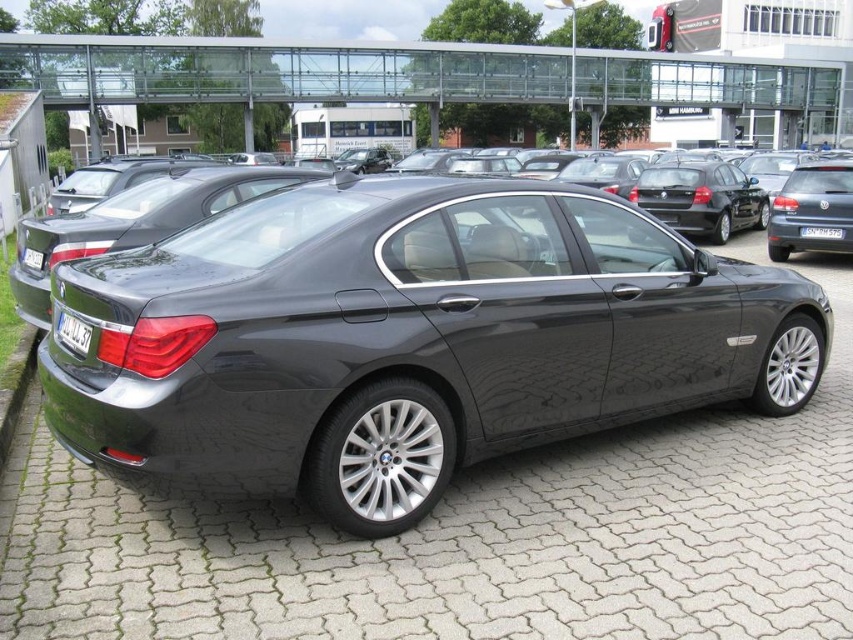
Is point (842, 227) positioned after point (70, 323)?

Yes.

Is matte black sedan at right to the left of black plastic license plate at rear from the viewer's perspective?

In fact, matte black sedan at right is to the right of black plastic license plate at rear.

Identify the location of matte black sedan at right. The width and height of the screenshot is (853, 640). (811, 211).

Image resolution: width=853 pixels, height=640 pixels. Identify the location of matte black sedan at right. (811, 211).

Is point (433, 362) farther from camera compared to point (24, 252)?

No, (433, 362) is closer to viewer.

Which is behind, point (67, 417) or point (39, 266)?

The point (39, 266) is behind.

Locate an element on the screen. satin black sedan at center is located at coordinates (409, 339).

The image size is (853, 640). I want to click on satin black sedan at center, so click(x=409, y=339).

How distant is satin black sedan at center from black plastic license plate at rear?

satin black sedan at center is 1.45 meters from black plastic license plate at rear.

Is point (206, 387) positioned in front of point (80, 353)?

Yes.

Locate an element on the screen. The image size is (853, 640). satin black sedan at center is located at coordinates (409, 339).